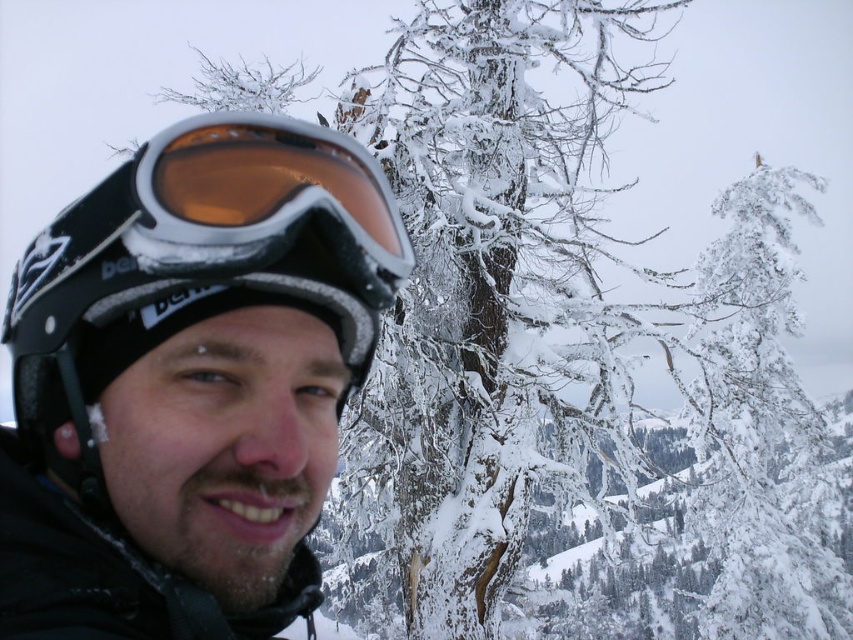
Is matte black helmet at left behind matte black goggles at left?

No, it is in front of matte black goggles at left.

Which is behind, point (88, 518) or point (148, 145)?

The point (148, 145) is more distant.

Is point (148, 432) in front of point (196, 124)?

Yes, point (148, 432) is closer to viewer.

Identify the location of matte black helmet at left. (189, 381).